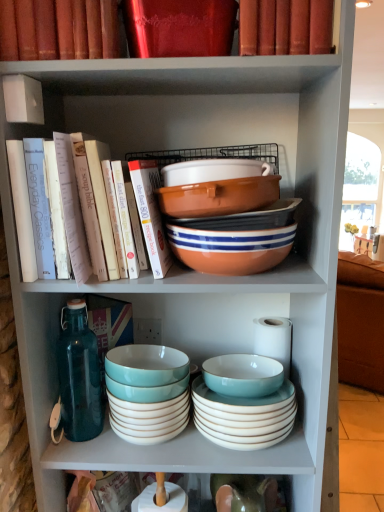
You are a GUI agent. You are given a task and a screenshot of the screen. Output one action in this format:
    pyautogui.click(x=<x>, y=<y>)
    Task: Click on the free point above orange glazed bowl at center, which is the 4th bowl in top-to-bottom order (from a real-world perspective)
    The height and width of the screenshot is (512, 384).
    Given the screenshot: What is the action you would take?
    pyautogui.click(x=245, y=220)